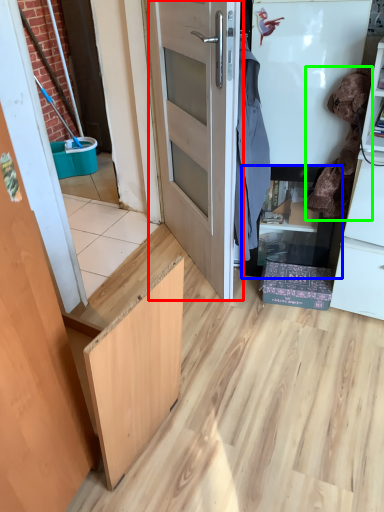
Question: Which is nearer to the door (highlighted by a red box)? cabinetry (highlighted by a blue box) or laundry (highlighted by a green box).

Choices:
 (A) cabinetry
 (B) laundry

Answer: (A)